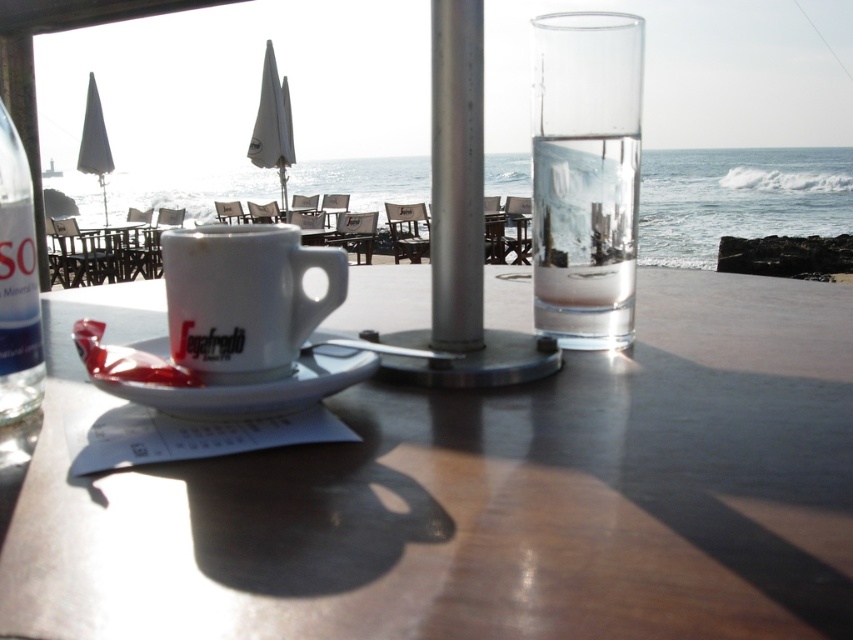
Question: Does clear glass water at upper center have a larger size compared to metallic pole at center?

Choices:
 (A) no
 (B) yes

Answer: (B)

Question: Which point appears closest to the camera in this image?

Choices:
 (A) (409, 189)
 (B) (225, 392)
 (C) (459, 518)

Answer: (C)

Question: Which point is closer to the camera?

Choices:
 (A) clear glass water at upper center
 (B) clear glass bottle at left
 (C) transparent glass at upper right

Answer: (B)

Question: Does matte white table at center have a lesser width compared to white glossy mug at center?

Choices:
 (A) yes
 (B) no

Answer: (B)

Question: Is the position of white glossy mug at center more distant than that of transparent glass at upper right?

Choices:
 (A) no
 (B) yes

Answer: (A)

Question: Which object is positioned closest to the matte white table at center?

Choices:
 (A) clear glass water at upper center
 (B) transparent glass at upper right
 (C) clear glass bottle at left
 (D) white glossy mug at center

Answer: (D)